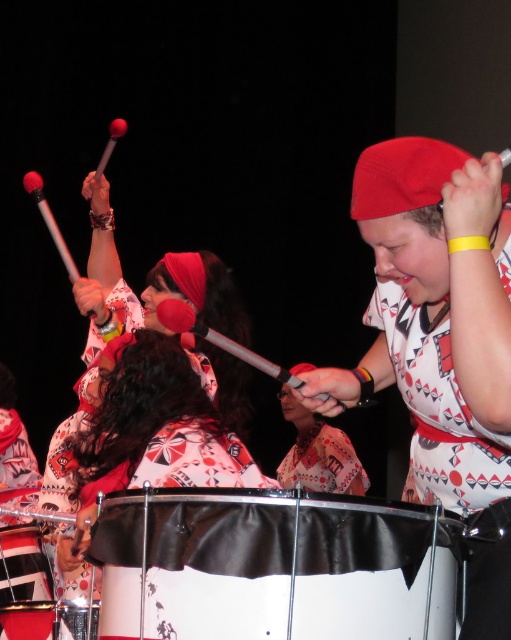
Between white printed dress at center and black leather drum at lower center, which one has more height?

With more height is white printed dress at center.

What do you see at coordinates (137, 440) in the screenshot? I see `white printed dress at center` at bounding box center [137, 440].

Image resolution: width=511 pixels, height=640 pixels. Identify the location of white printed dress at center. (137, 440).

The width and height of the screenshot is (511, 640). I want to click on white matte drum at center, so click(295, 566).

What do you see at coordinates (295, 566) in the screenshot? Image resolution: width=511 pixels, height=640 pixels. I see `white matte drum at center` at bounding box center [295, 566].

This screenshot has height=640, width=511. In order to click on white matte drum at center in this screenshot , I will do `click(295, 566)`.

Which is above, white printed dress at center or printed fabric drumstick at center?

white printed dress at center is above.

What do you see at coordinates (137, 440) in the screenshot?
I see `white printed dress at center` at bounding box center [137, 440].

Between point (133, 460) and point (334, 435), which one is positioned behind?

Point (334, 435)

What are the coordinates of `white printed dress at center` in the screenshot? It's located at (137, 440).